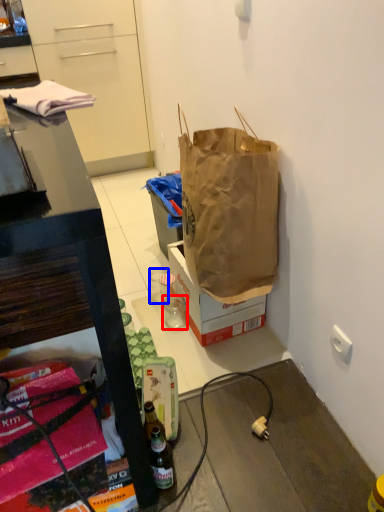
Question: Which object is further to the camera taking this photo, coffee cup (highlighted by a red box) or coffee cup (highlighted by a blue box)?

Choices:
 (A) coffee cup
 (B) coffee cup

Answer: (B)